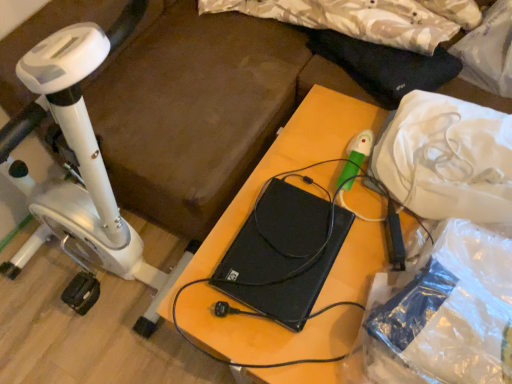
The image size is (512, 384). In order to click on free space above black matte laptop at center (from a real-world perspective) in this screenshot , I will do `click(290, 246)`.